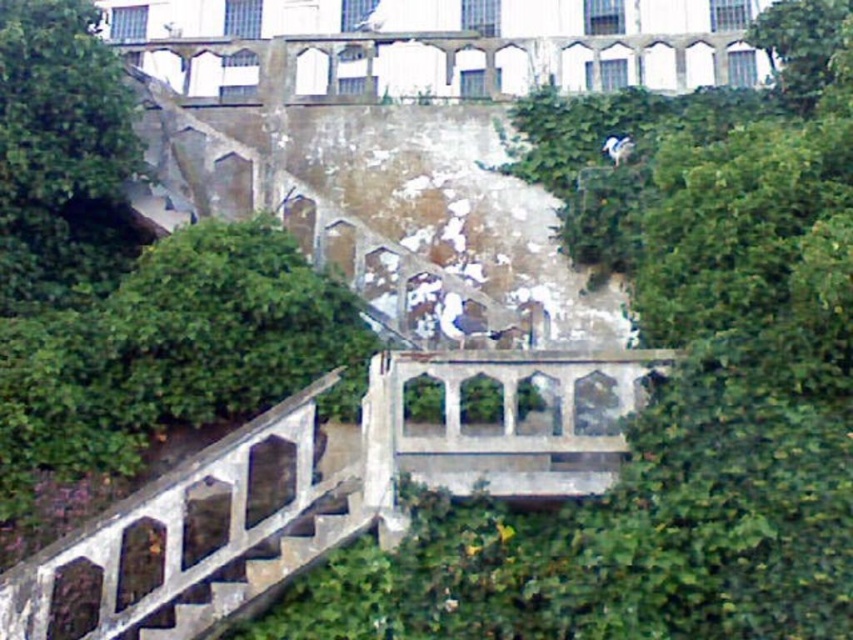
Does green leafy tree at upper left appear on the left side of green leafy tree at upper right?

Indeed, green leafy tree at upper left is positioned on the left side of green leafy tree at upper right.

Identify the location of green leafy tree at upper left. This screenshot has width=853, height=640. (125, 280).

Which is behind, point (199, 330) or point (817, 77)?

Point (817, 77)

At what (x,y) coordinates should I click in order to perform the action: click on green leafy tree at upper left. Please return your answer as a coordinate pair (x, y). Looking at the image, I should click on (125, 280).

Does green leafy tree at left have a larger size compared to green leafy tree at upper right?

No.

The image size is (853, 640). What do you see at coordinates (62, 156) in the screenshot? I see `green leafy tree at left` at bounding box center [62, 156].

Where is `green leafy tree at left`? green leafy tree at left is located at coordinates (62, 156).

Can you confirm if green leafy tree at upper left is shorter than green leafy tree at left?

Incorrect, green leafy tree at upper left's height does not fall short of green leafy tree at left's.

How much distance is there between green leafy tree at upper left and green leafy tree at left?

green leafy tree at upper left and green leafy tree at left are 4.20 meters apart from each other.

Image resolution: width=853 pixels, height=640 pixels. I want to click on green leafy tree at upper left, so coord(125,280).